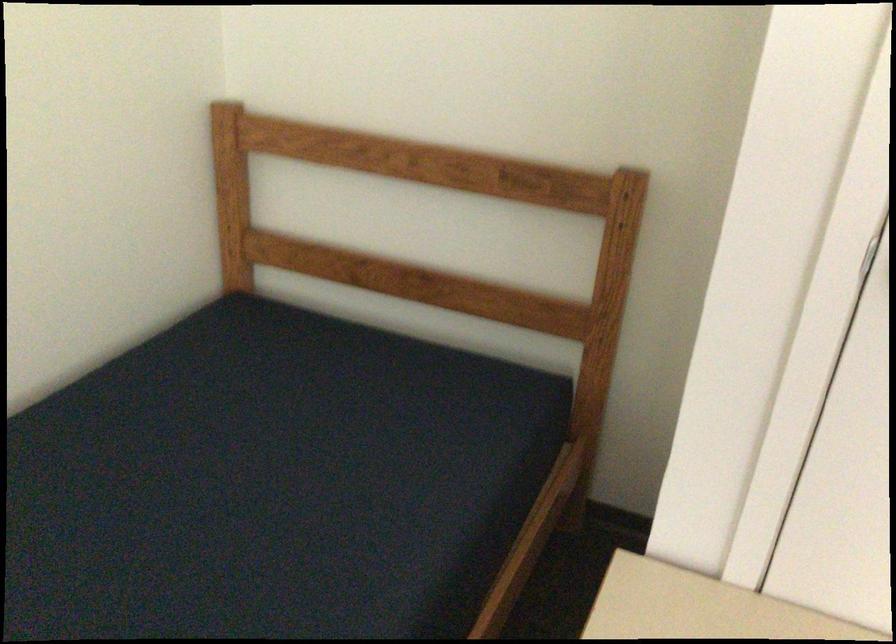
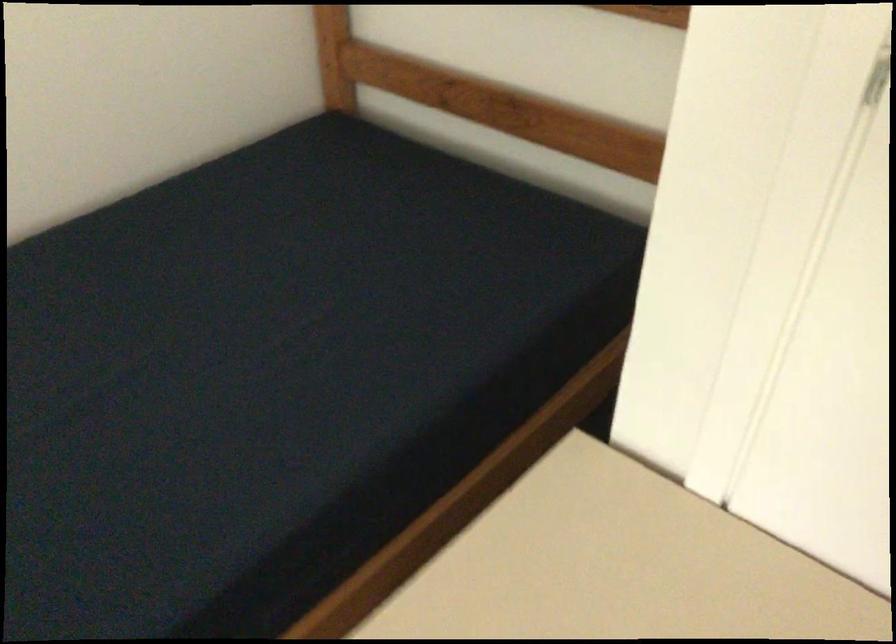
What movement of the cameraman would produce the second image?

The cameraman moved toward right, forward.